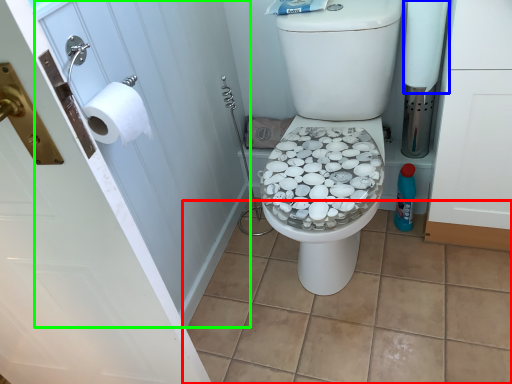
Question: Estimate the real-world distances between objects in this image. Which object is farther from tile (highlighted by a red box), toilet paper (highlighted by a blue box) or screen door (highlighted by a green box)?

Choices:
 (A) toilet paper
 (B) screen door

Answer: (A)